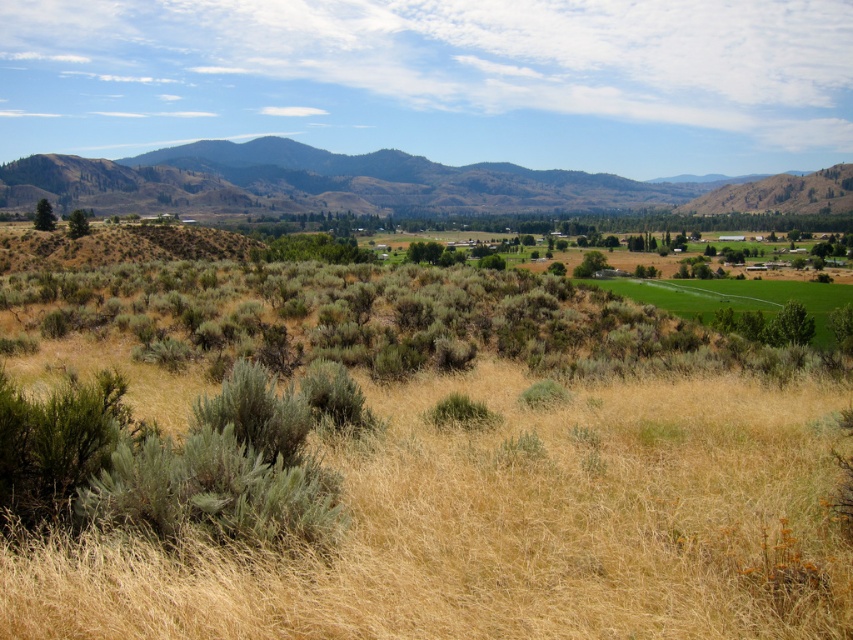
Does dry grassland at center have a greater width compared to brown textured mountains at upper left?

In fact, dry grassland at center might be narrower than brown textured mountains at upper left.

Between point (120, 337) and point (270, 189), which one is positioned behind?

The point (270, 189) is more distant.

Measure the distance between dry grassland at center and camera.

dry grassland at center and camera are 4.43 meters apart from each other.

I want to click on dry grassland at center, so click(x=425, y=461).